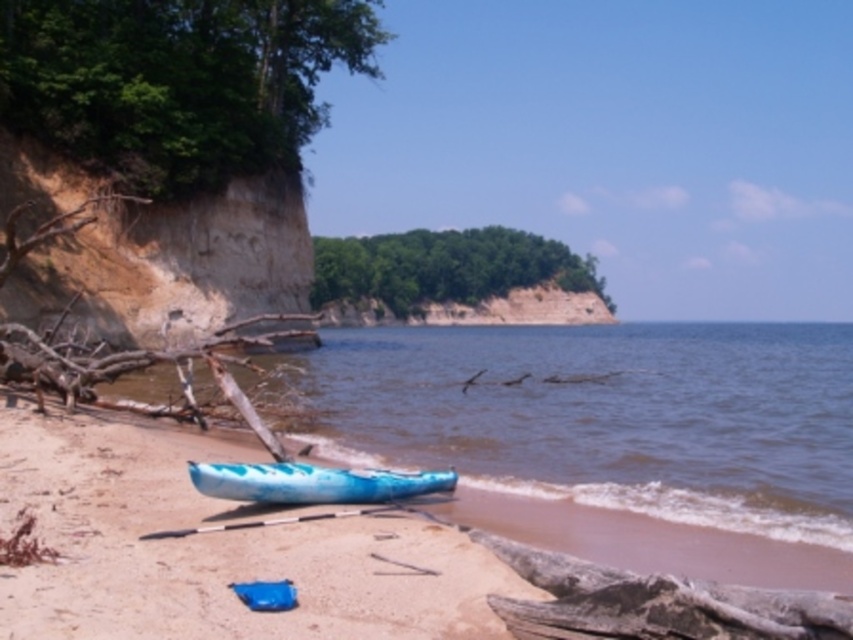
You are a photographer standing on the beach and want to capture both the blue plastic kayak at center and the blue glossy canoe at lower center in a single shot. Based on their positions, which one should you position closer to the left side of your camera frame?

The blue plastic kayak at center should be positioned closer to the left side of your camera frame because it is already located to the left of the blue glossy canoe at lower center.